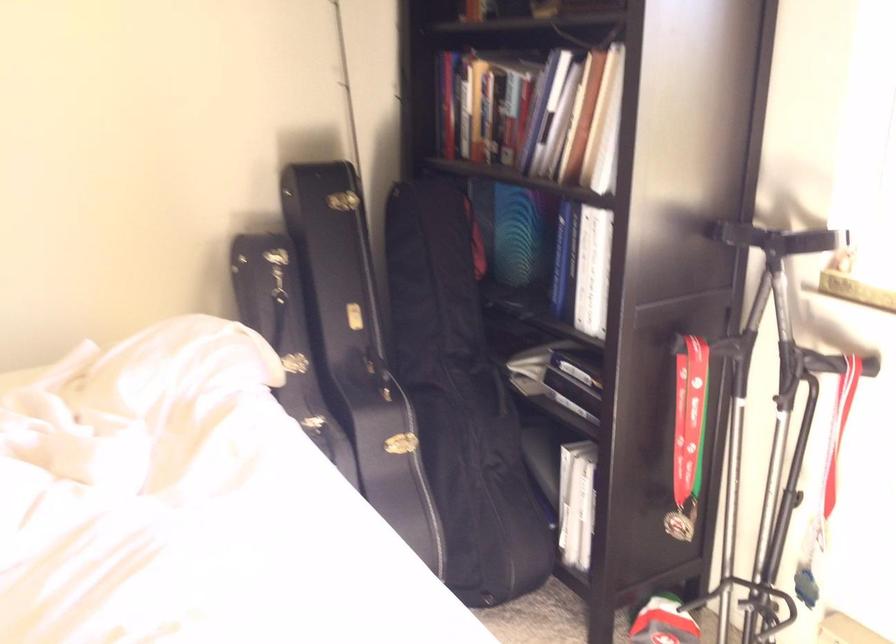
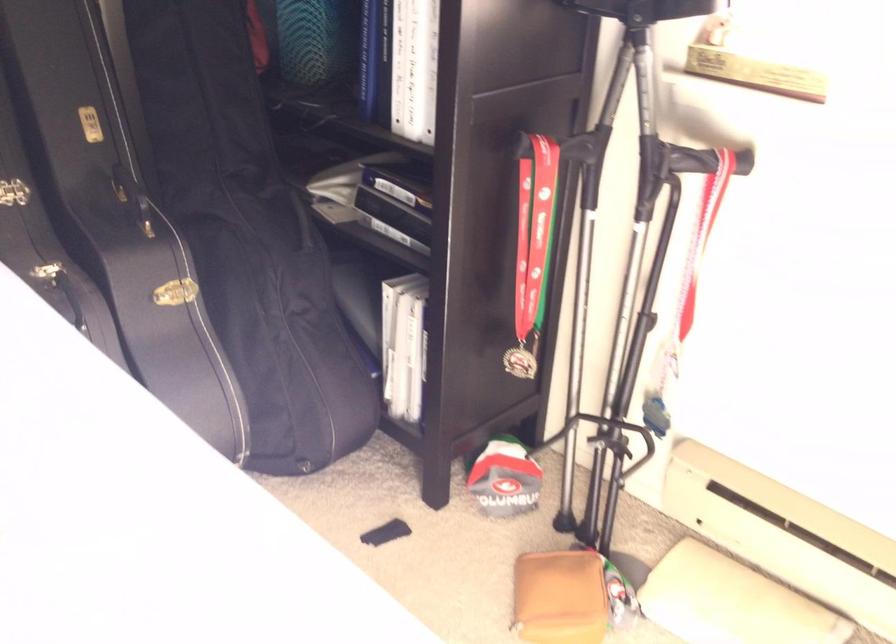
Question: Which direction would the cameraman need to move to produce the second image? Reply with the corresponding letter.

Choices:
 (A) Left
 (B) Right
 (C) Forward
 (D) Backward

Answer: (C)